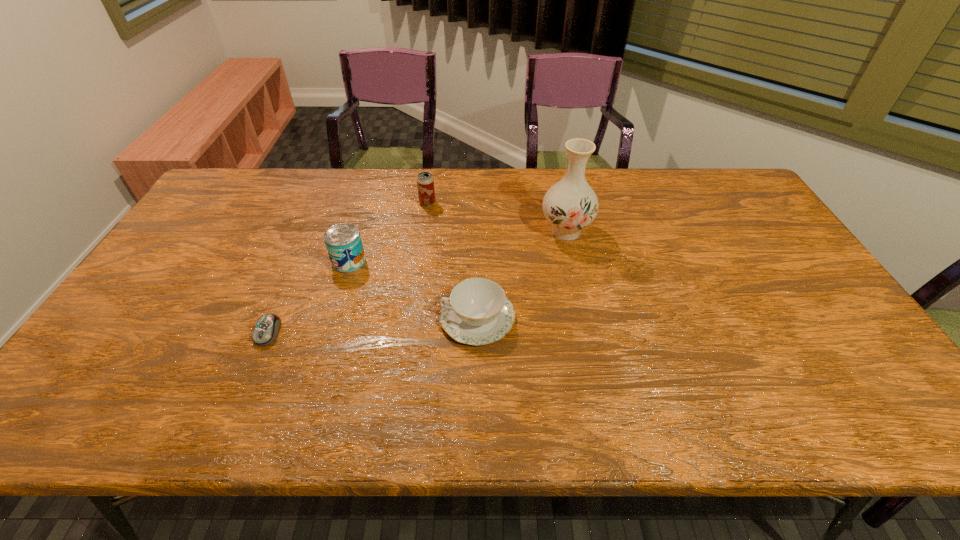
Find the location of a particular element. the fourth nearest object is located at coordinates (570, 205).

Locate an element on the screen. The image size is (960, 540). vase is located at coordinates (570, 205).

At what (x,y) coordinates should I click in order to perform the action: click on the third object from right to left. Please return your answer as a coordinate pair (x, y). Image resolution: width=960 pixels, height=540 pixels. Looking at the image, I should click on (425, 183).

You are a GUI agent. You are given a task and a screenshot of the screen. Output one action in this format:
    pyautogui.click(x=<x>, y=<y>)
    Task: Click on the farthest object
    The image size is (960, 540).
    Given the screenshot: What is the action you would take?
    pyautogui.click(x=425, y=183)

Find the location of a particular element. the fourth object from right to left is located at coordinates (343, 241).

Locate an element on the screen. This screenshot has width=960, height=540. the third nearest object is located at coordinates (343, 241).

Find the location of a particular element. the second object from right to left is located at coordinates (477, 312).

This screenshot has width=960, height=540. Find the location of `chinaware`. chinaware is located at coordinates (477, 312).

Locate an element on the screen. This screenshot has height=540, width=960. the leftmost object is located at coordinates (266, 330).

Locate an element on the screen. The height and width of the screenshot is (540, 960). computer mouse is located at coordinates (266, 330).